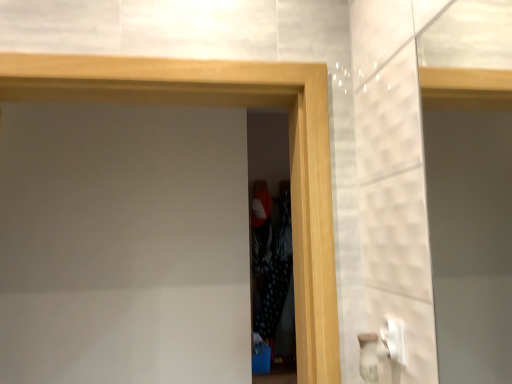
Question: Considering the positions of black dotted fabric at center, the second screen door viewed from the front, and wooden frame at center, marked as the first screen door in a front-to-back arrangement, in the image, is black dotted fabric at center, the second screen door viewed from the front, taller or shorter than wooden frame at center, marked as the first screen door in a front-to-back arrangement,?

Choices:
 (A) short
 (B) tall

Answer: (B)

Question: Does point (269, 155) appear closer or farther from the camera than point (309, 334)?

Choices:
 (A) farther
 (B) closer

Answer: (A)

Question: Looking at the image, does black dotted fabric at center, acting as the 1th screen door starting from the back, seem bigger or smaller compared to wooden frame at center, the second screen door viewed from the back?

Choices:
 (A) small
 (B) big

Answer: (A)

Question: Considering their positions, is wooden frame at center, the second screen door viewed from the back, located in front of or behind black dotted fabric at center, acting as the 1th screen door starting from the back?

Choices:
 (A) behind
 (B) front

Answer: (B)

Question: Considering the positions of point (229, 84) and point (257, 314), is point (229, 84) closer or farther from the camera than point (257, 314)?

Choices:
 (A) farther
 (B) closer

Answer: (B)

Question: From a real-world perspective, is wooden frame at center, marked as the first screen door in a front-to-back arrangement, above or below black dotted fabric at center, the second screen door viewed from the front?

Choices:
 (A) above
 (B) below

Answer: (A)

Question: Considering the positions of wooden frame at center, marked as the first screen door in a front-to-back arrangement, and black dotted fabric at center, acting as the 1th screen door starting from the back, in the image, is wooden frame at center, marked as the first screen door in a front-to-back arrangement, wider or thinner than black dotted fabric at center, acting as the 1th screen door starting from the back,?

Choices:
 (A) wide
 (B) thin

Answer: (A)